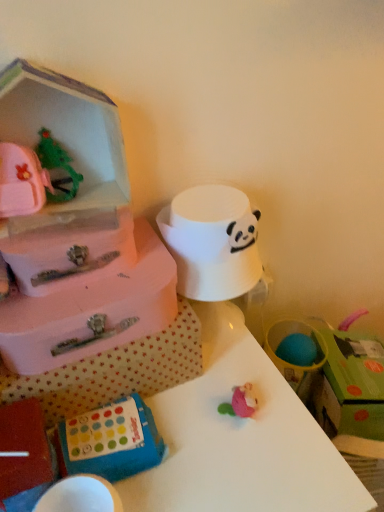
Question: From the image's perspective, relative to green cardboard box at upper right, is white glossy table at center above or below?

Choices:
 (A) above
 (B) below

Answer: (B)

Question: Considering the positions of point (66, 412) and point (362, 352), is point (66, 412) closer or farther from the camera than point (362, 352)?

Choices:
 (A) closer
 (B) farther

Answer: (A)

Question: Which object is the closest to the green cardboard box at upper right?

Choices:
 (A) white glossy table at center
 (B) blue rubbery toy at lower center

Answer: (A)

Question: Estimate the real-world distances between objects in this image. Which object is farther from the white glossy table at center?

Choices:
 (A) blue rubbery toy at lower center
 (B) green cardboard box at upper right

Answer: (B)